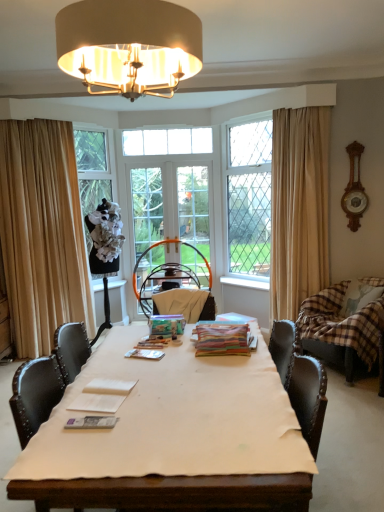
You are a GUI agent. You are given a task and a screenshot of the screen. Output one action in this format:
    pyautogui.click(x=<x>, y=<y>)
    Task: Click on the free spot to the left of matte white magazine at center, which is the first magazine from left to right
    This screenshot has width=384, height=512.
    Given the screenshot: What is the action you would take?
    pyautogui.click(x=52, y=432)